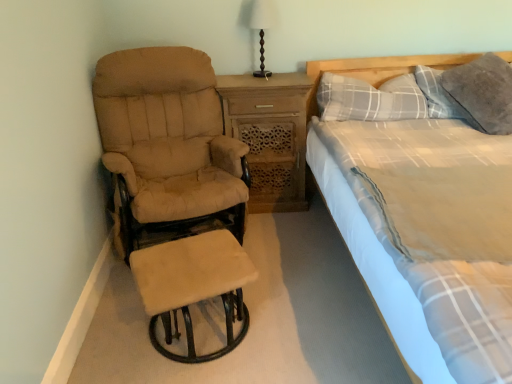
Where is `free space in front of beige fabric recliner at left`? The width and height of the screenshot is (512, 384). free space in front of beige fabric recliner at left is located at coordinates 144,337.